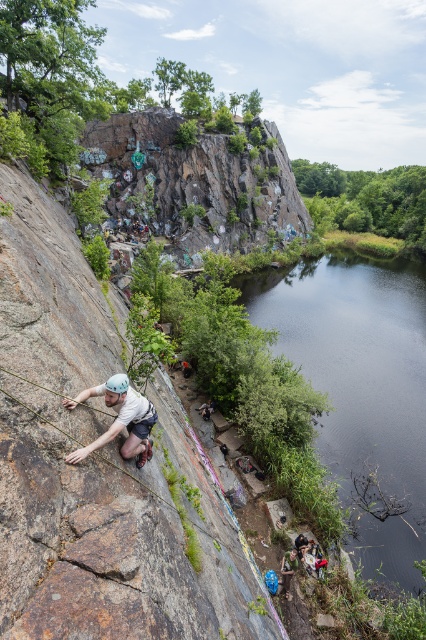
Question: Which point appears farthest from the camera in this image?

Choices:
 (A) click(x=288, y=588)
 (B) click(x=54, y=403)
 (C) click(x=120, y=420)

Answer: (A)

Question: Is matte white helmet at left positioned before blue rubber boots at lower center?

Choices:
 (A) no
 (B) yes

Answer: (B)

Question: Observing the image, what is the correct spatial positioning of brown rough rock at left in reference to matte white helmet at left?

Choices:
 (A) above
 (B) below

Answer: (A)

Question: Which is farther from the matte white helmet at left?

Choices:
 (A) blue rubber boots at lower center
 (B) brown rough rock at left

Answer: (A)

Question: Can you confirm if brown rough rock at left is thinner than blue rubber boots at lower center?

Choices:
 (A) no
 (B) yes

Answer: (A)

Question: Which is farther from the brown rough rock at left?

Choices:
 (A) blue rubber boots at lower center
 (B) matte white helmet at left

Answer: (A)